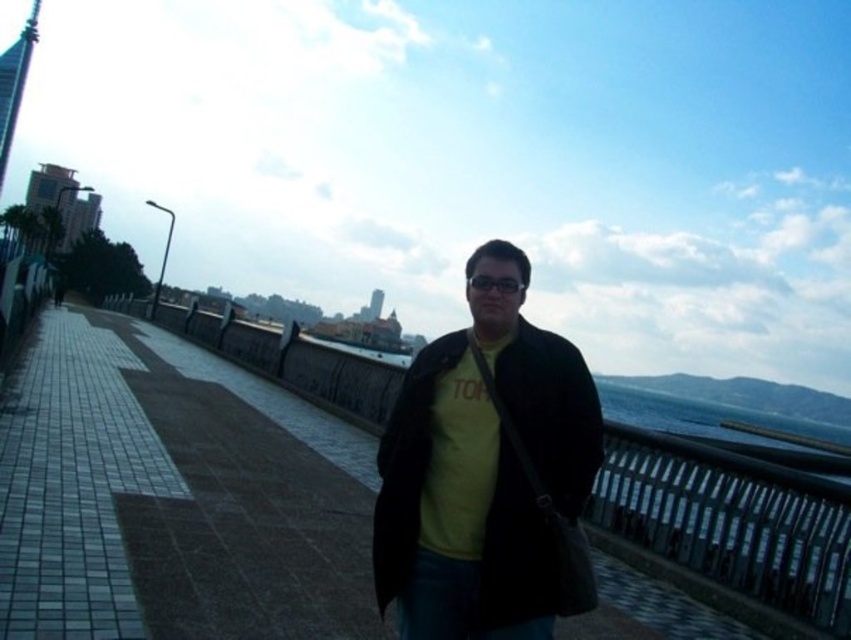
Question: Which of the following is the closest to the observer?

Choices:
 (A) (417, 568)
 (B) (184, 323)

Answer: (A)

Question: Does yellow matte shirt at center appear over black metal rail at center?

Choices:
 (A) no
 (B) yes

Answer: (B)

Question: Can you confirm if yellow matte shirt at center is positioned above black metal rail at center?

Choices:
 (A) no
 (B) yes

Answer: (B)

Question: Which point appears closest to the camera in this image?

Choices:
 (A) (543, 426)
 (B) (707, 550)

Answer: (A)

Question: Where is yellow matte shirt at center located in relation to black metal rail at center in the image?

Choices:
 (A) right
 (B) left

Answer: (B)